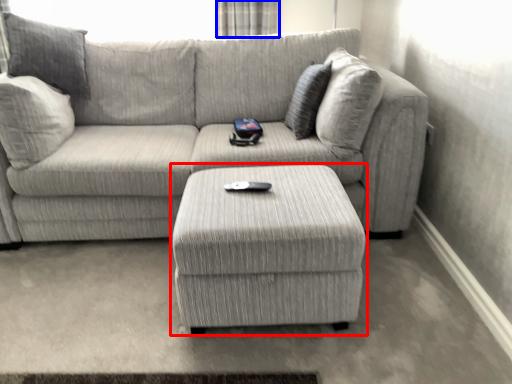
Question: Among these objects, which one is farthest to the camera, table (highlighted by a red box) or curtain (highlighted by a blue box)?

Choices:
 (A) table
 (B) curtain

Answer: (B)